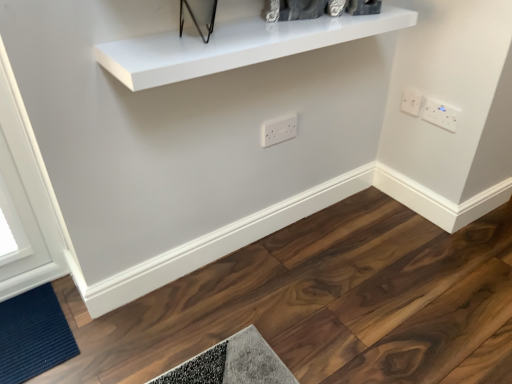
Question: Is white plastic electric outlet at upper right, which ranks as the 3th electric outlet in left-to-right order, facing towards white plastic outlet at center, which is counted as the 1th electric outlet, starting from the left?

Choices:
 (A) yes
 (B) no

Answer: (A)

Question: From the image's perspective, is white plastic electric outlet at upper right, which ranks as the 3th electric outlet in left-to-right order, below white plastic outlet at center, which is the 3th electric outlet in right-to-left order?

Choices:
 (A) yes
 (B) no

Answer: (B)

Question: Is white plastic electric outlet at upper right, positioned as the 1th electric outlet in right-to-left order, shorter than white plastic outlet at center, which is counted as the 1th electric outlet, starting from the left?

Choices:
 (A) yes
 (B) no

Answer: (A)

Question: From a real-world perspective, is white plastic electric outlet at upper right, which ranks as the 3th electric outlet in left-to-right order, under white plastic outlet at center, which is counted as the 1th electric outlet, starting from the left?

Choices:
 (A) yes
 (B) no

Answer: (B)

Question: Is white plastic outlet at center, which is the 3th electric outlet in right-to-left order, surrounded by white plastic electric outlet at upper right, positioned as the 1th electric outlet in right-to-left order?

Choices:
 (A) yes
 (B) no

Answer: (B)

Question: Relative to white glossy shelf at upper center, is dark blue textured mat at lower left in front or behind?

Choices:
 (A) behind
 (B) front

Answer: (A)

Question: From their relative heights in the image, would you say dark blue textured mat at lower left is taller or shorter than white glossy shelf at upper center?

Choices:
 (A) short
 (B) tall

Answer: (A)

Question: From the image's perspective, relative to white glossy shelf at upper center, is dark blue textured mat at lower left above or below?

Choices:
 (A) below
 (B) above

Answer: (A)

Question: From a real-world perspective, relative to white glossy shelf at upper center, is dark blue textured mat at lower left vertically above or below?

Choices:
 (A) below
 (B) above

Answer: (A)

Question: Is point (2, 311) closer or farther from the camera than point (422, 107)?

Choices:
 (A) farther
 (B) closer

Answer: (B)

Question: Based on their sizes in the image, would you say dark blue textured mat at lower left is bigger or smaller than white plastic electric outlet at upper right, positioned as the 1th electric outlet in right-to-left order?

Choices:
 (A) small
 (B) big

Answer: (B)

Question: Considering the positions of dark blue textured mat at lower left and white plastic electric outlet at upper right, which ranks as the 3th electric outlet in left-to-right order, in the image, is dark blue textured mat at lower left taller or shorter than white plastic electric outlet at upper right, which ranks as the 3th electric outlet in left-to-right order,?

Choices:
 (A) short
 (B) tall

Answer: (A)

Question: In the image, is dark blue textured mat at lower left positioned in front of or behind white plastic electric outlet at upper right, which ranks as the 3th electric outlet in left-to-right order?

Choices:
 (A) behind
 (B) front

Answer: (B)

Question: Does point (415, 92) appear closer or farther from the camera than point (136, 71)?

Choices:
 (A) closer
 (B) farther

Answer: (B)

Question: Based on their sizes in the image, would you say white plastic socket at upper right, acting as the 2th electric outlet starting from the left, is bigger or smaller than white glossy shelf at upper center?

Choices:
 (A) big
 (B) small

Answer: (B)